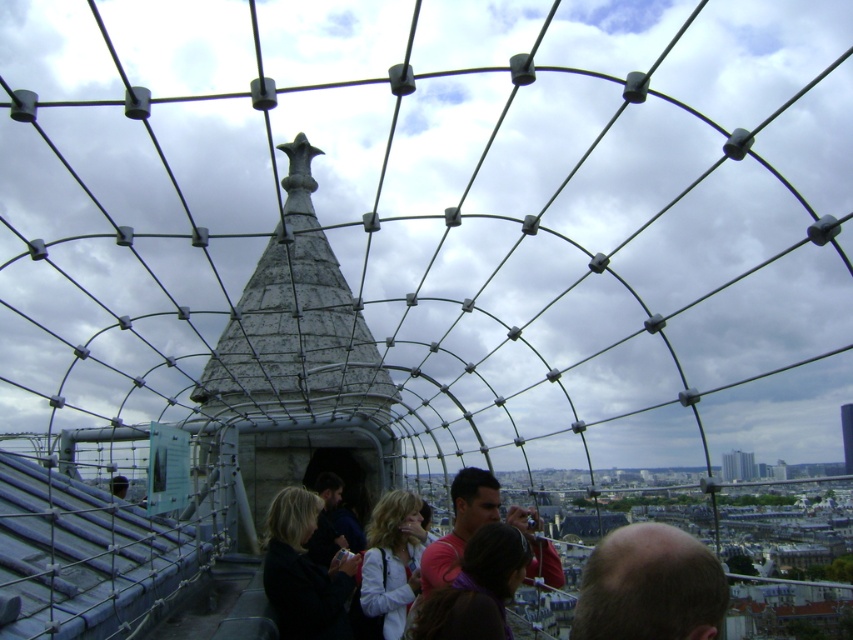
Can you confirm if bald head at center is thinner than dark gray jacket at center?

In fact, bald head at center might be wider than dark gray jacket at center.

Which is behind, point (695, 557) or point (312, 502)?

Positioned behind is point (312, 502).

This screenshot has width=853, height=640. What are the coordinates of `bald head at center` in the screenshot? It's located at (648, 586).

The image size is (853, 640). In order to click on bald head at center in this screenshot , I will do `click(648, 586)`.

Who is lower down, dark gray jacket at center or blonde hair at center?

blonde hair at center is below.

Can you confirm if dark gray jacket at center is positioned to the left of blonde hair at center?

Yes, dark gray jacket at center is to the left of blonde hair at center.

Describe the element at coordinates (303, 572) in the screenshot. I see `dark gray jacket at center` at that location.

The image size is (853, 640). I want to click on dark gray jacket at center, so click(303, 572).

Who is shorter, bald head at center or blonde hair at center?

bald head at center is shorter.

Does bald head at center have a lesser width compared to blonde hair at center?

In fact, bald head at center might be wider than blonde hair at center.

Which is behind, point (624, 554) or point (387, 608)?

The point (387, 608) is more distant.

The width and height of the screenshot is (853, 640). I want to click on bald head at center, so click(648, 586).